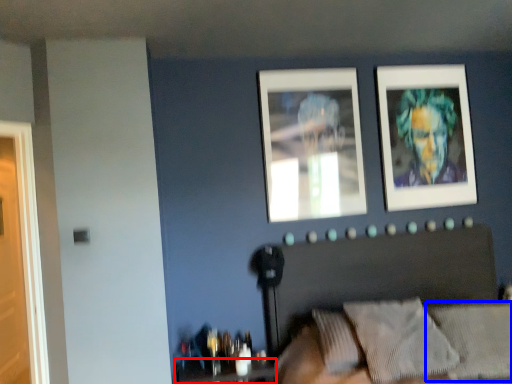
Question: Which of the following is the closest to the observer, table (highlighted by a red box) or pillow (highlighted by a blue box)?

Choices:
 (A) table
 (B) pillow

Answer: (B)